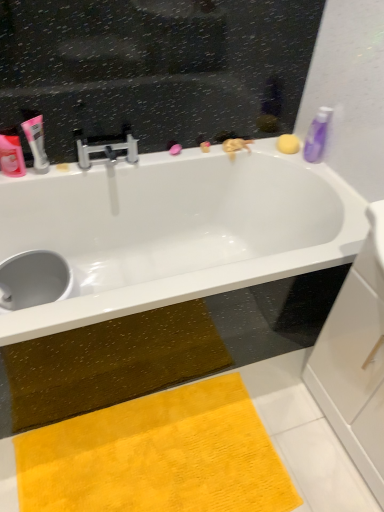
This screenshot has width=384, height=512. Find the location of `vacant area in front of yellow sponge at upper right`. vacant area in front of yellow sponge at upper right is located at coordinates (303, 164).